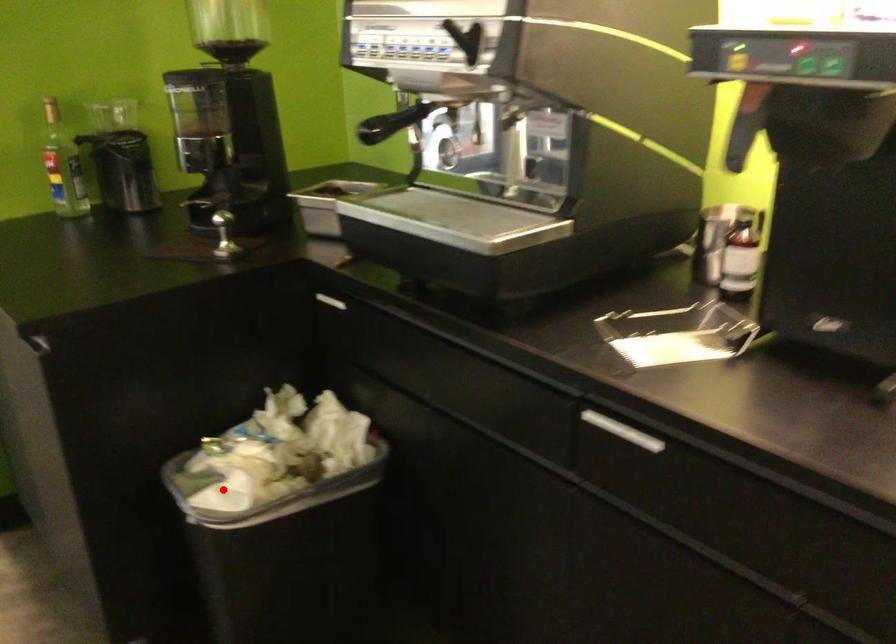
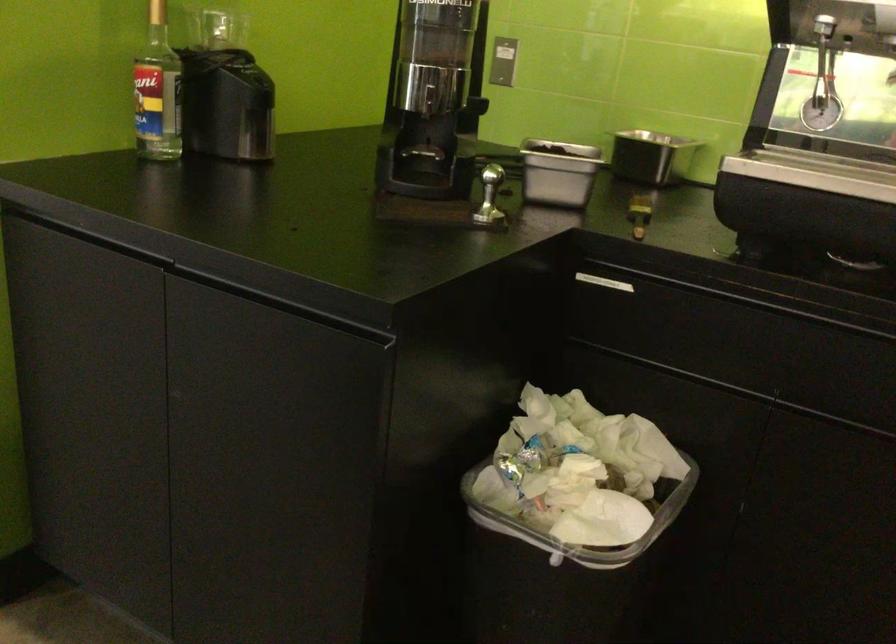
Question: I am providing you with two images of the same scene from different viewpoints. Image1 has a red point marked. In image2, the corresponding 3D location appears at what relative position? Reply with the corresponding letter.

Choices:
 (A) Closer
 (B) Farther

Answer: (A)